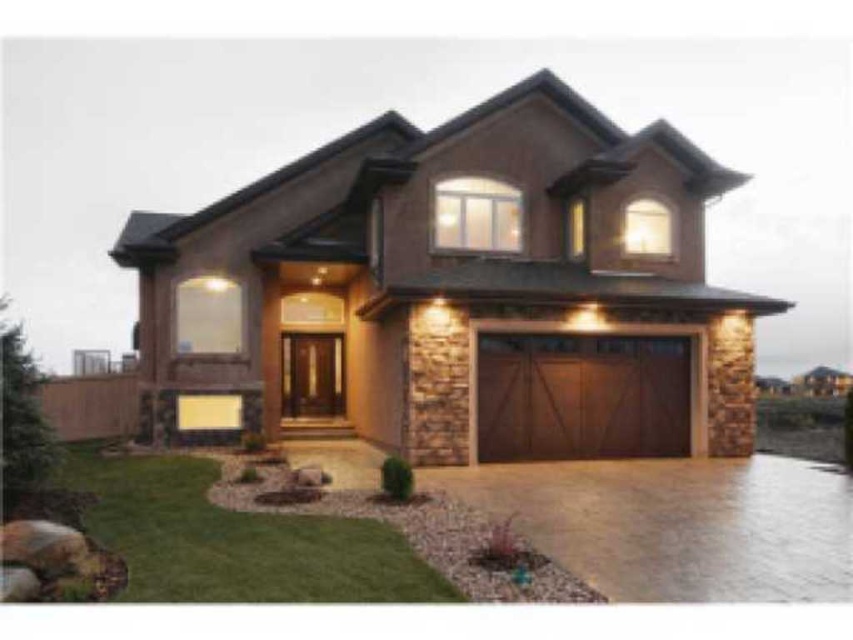
Question: Which of the following is the farthest from the observer?

Choices:
 (A) wooden at center
 (B) brown wood/glass garage at center

Answer: (A)

Question: Is brown wood/glass garage at center smaller than wooden at center?

Choices:
 (A) yes
 (B) no

Answer: (B)

Question: Can you confirm if brown wood/glass garage at center is positioned above wooden at center?

Choices:
 (A) no
 (B) yes

Answer: (B)

Question: Which point is closer to the camera?

Choices:
 (A) (699, 310)
 (B) (602, 413)

Answer: (B)

Question: Which point is closer to the camera?

Choices:
 (A) wooden at center
 (B) brown wood/glass garage at center

Answer: (B)

Question: Does brown wood/glass garage at center appear on the right side of wooden at center?

Choices:
 (A) yes
 (B) no

Answer: (B)